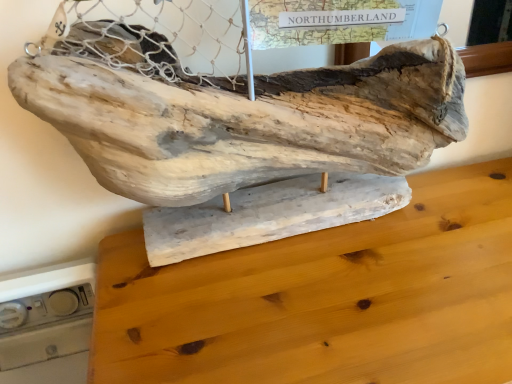
The width and height of the screenshot is (512, 384). I want to click on free space in front of natural wood sculpture at center, so click(291, 316).